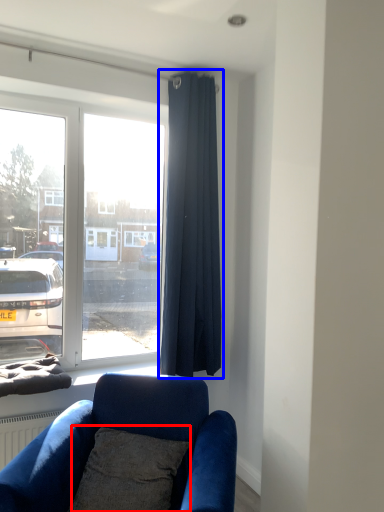
Question: Which point is closer to the camera, pillow (highlighted by a red box) or curtain (highlighted by a blue box)?

Choices:
 (A) pillow
 (B) curtain

Answer: (A)